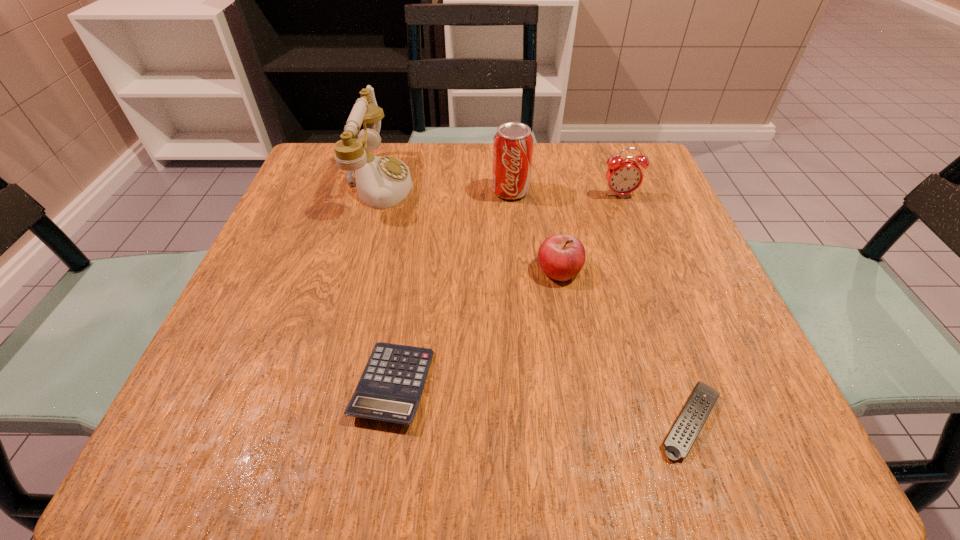
Locate an element on the screen. the tallest object is located at coordinates (382, 182).

Find the location of a particular element. Image resolution: width=960 pixels, height=540 pixels. soda can is located at coordinates (513, 143).

Identify the location of the fourth shortest object. The image size is (960, 540). (624, 176).

Identify the location of the third nearest object. This screenshot has height=540, width=960. (561, 257).

Where is `the third shortest object`? the third shortest object is located at coordinates (561, 257).

Identify the location of calculator. (390, 389).

This screenshot has height=540, width=960. Identify the location of the shortest object. (680, 439).

Image resolution: width=960 pixels, height=540 pixels. In order to click on vacant position located 0.170m on the dial of the telephone in this screenshot , I will do `click(490, 183)`.

Find the location of `blank space located 0.400m on the front of the second tallest object`. blank space located 0.400m on the front of the second tallest object is located at coordinates (x=524, y=363).

This screenshot has height=540, width=960. What are the coordinates of `vacant position located on the face of the third tallest object` in the screenshot? It's located at (630, 224).